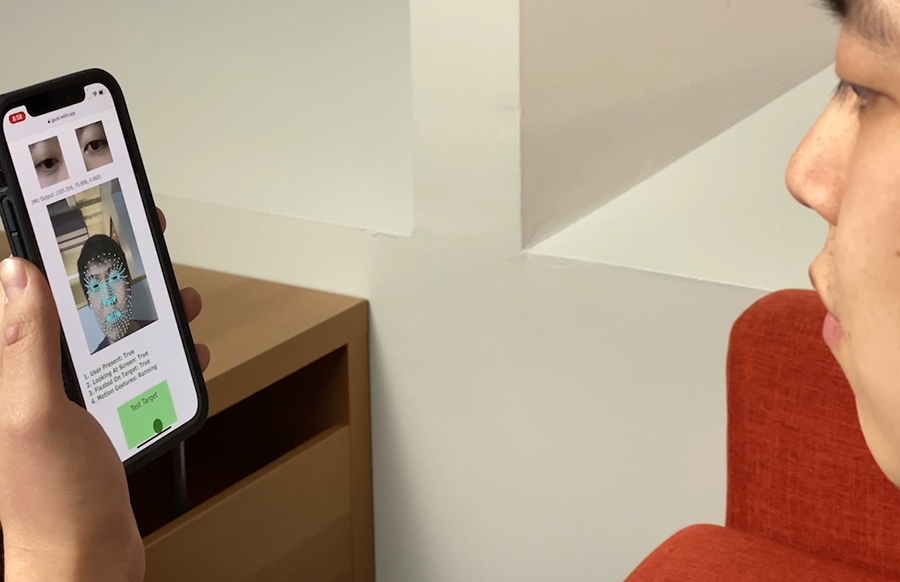
In order to click on wall in this screenshot , I will do `click(594, 392)`.